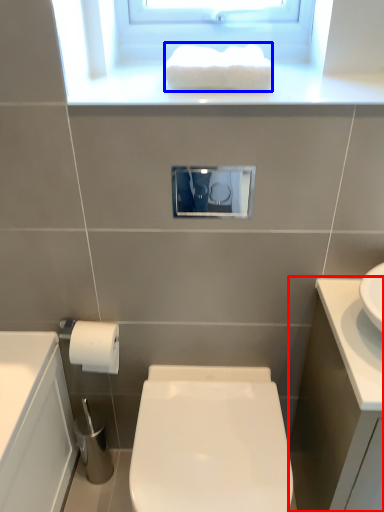
Question: Which object is closer to the camera taking this photo, bathroom cabinet (highlighted by a red box) or hand towel (highlighted by a blue box)?

Choices:
 (A) bathroom cabinet
 (B) hand towel

Answer: (A)